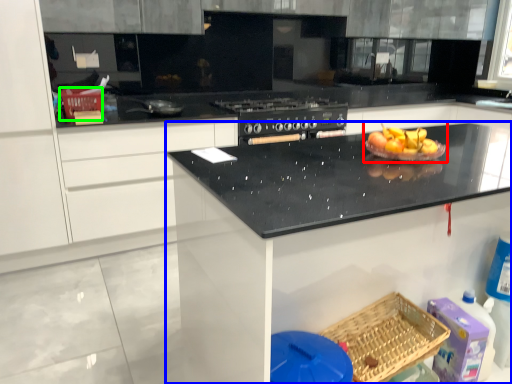
Question: Considering the real-world distances, which object is farthest from fruit dish (highlighted by a red box)? countertop (highlighted by a blue box) or basket (highlighted by a green box)?

Choices:
 (A) countertop
 (B) basket

Answer: (B)